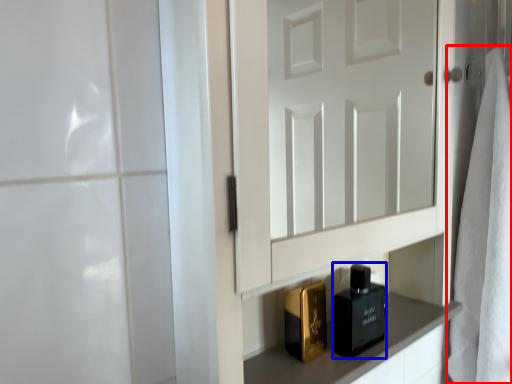
Question: Which object appears closest to the camera in this image, bath towel (highlighted by a red box) or perfume (highlighted by a blue box)?

Choices:
 (A) bath towel
 (B) perfume

Answer: (B)